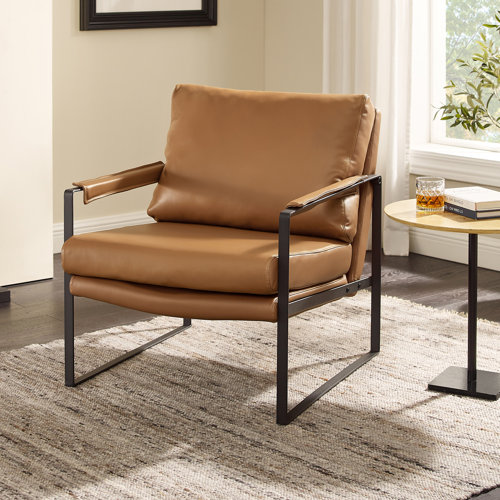
At what (x,y) coordinates should I click in order to perform the action: click on brown pleather cushions. Please return your answer as a coordinate pair (x, y). Image resolution: width=500 pixels, height=500 pixels. Looking at the image, I should click on pyautogui.click(x=242, y=152), pyautogui.click(x=205, y=248), pyautogui.click(x=188, y=304).